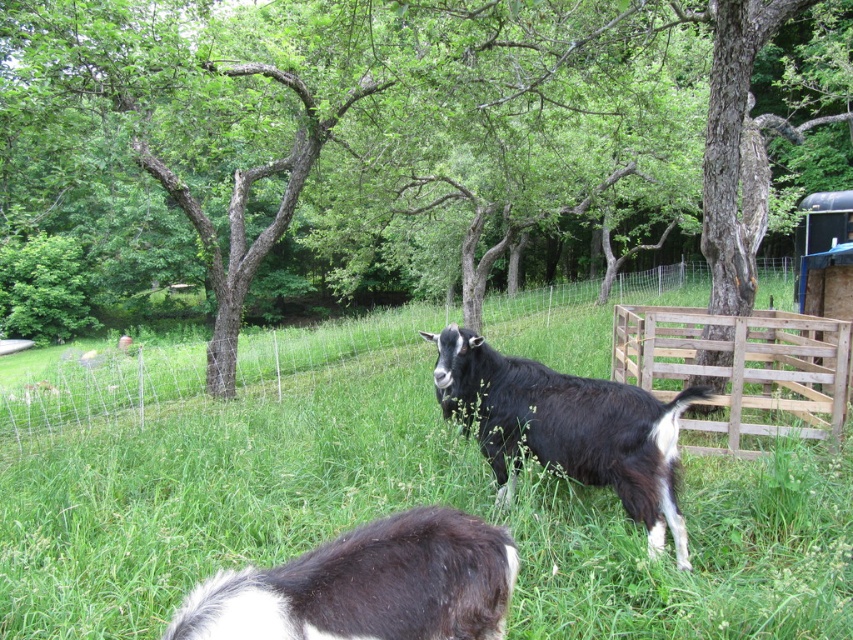
You are standing at the center of the image and want to walk towards the wooded area in the background. Which direction should you head from the green grassy at center to reach the wooded area?

The green grassy at center is located at point (x=216, y=493). Since the wooded area is in the background beyond the wire fence that runs diagonally, you should head towards the direction opposite of the green grassy at center to reach the wooded area.

You are a photographer trying to capture a photo of the goats. You want to ensure the wooden fence at center is visible in the background behind the green grassy at center. Based on their heights, is this possible?

The green grassy at center is not as tall as the wooden fence at center, so yes, the fence will be visible behind the grass since it is taller.